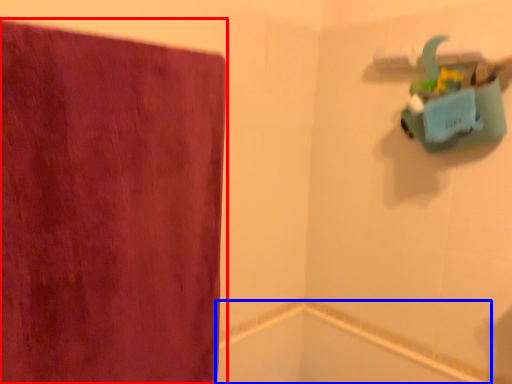
Question: Which point is further to the camera, towel (highlighted by a red box) or bath (highlighted by a blue box)?

Choices:
 (A) towel
 (B) bath

Answer: (B)